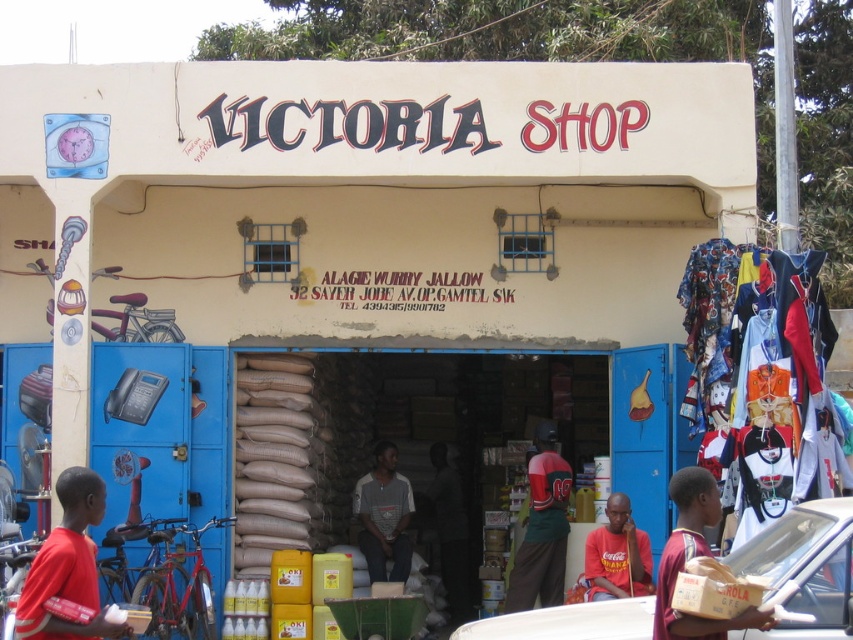
Does red matte shirt at left have a lesser height compared to green jersey at center?

Yes.

Describe the element at coordinates (67, 566) in the screenshot. I see `red matte shirt at left` at that location.

Between point (82, 525) and point (553, 442), which one is positioned behind?

Point (553, 442)

Identify the location of red matte shirt at left. This screenshot has height=640, width=853. (67, 566).

Does white plastic car at lower right come in front of red matte shirt at left?

Yes, it is.

Does white plastic car at lower right appear on the left side of red matte shirt at left?

Incorrect, white plastic car at lower right is not on the left side of red matte shirt at left.

This screenshot has height=640, width=853. I want to click on white plastic car at lower right, so click(804, 568).

Does point (20, 593) come in front of point (659, 561)?

Yes.

You are a GUI agent. You are given a task and a screenshot of the screen. Output one action in this format:
    pyautogui.click(x=<x>, y=<y>)
    Task: Click on the red matte shirt at left
    
    Given the screenshot: What is the action you would take?
    click(67, 566)